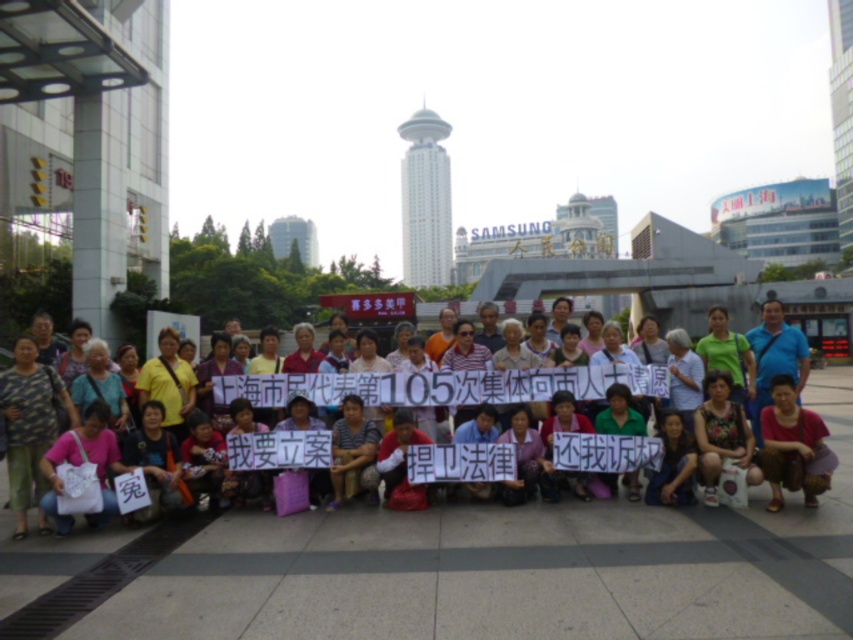
Is matte pink shirt at center taller than matte pink blouse at center?

Yes, matte pink shirt at center is taller than matte pink blouse at center.

Consider the image. Can you confirm if matte pink shirt at center is smaller than matte pink blouse at center?

Actually, matte pink shirt at center might be larger than matte pink blouse at center.

Find the location of `matte pink shirt at center`. matte pink shirt at center is located at coordinates (439, 385).

The width and height of the screenshot is (853, 640). I want to click on matte pink shirt at center, so [439, 385].